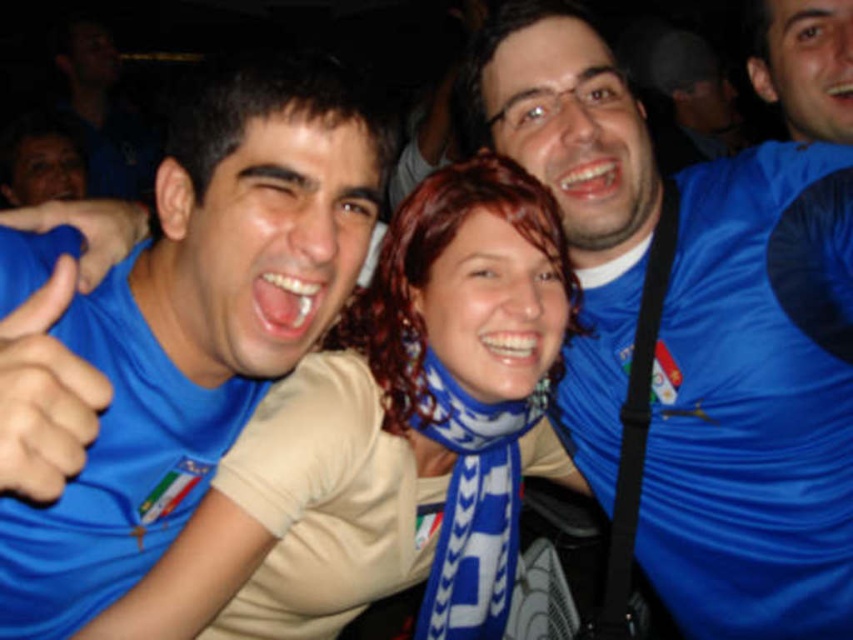
Question: Which of the following is the closest to the observer?

Choices:
 (A) blue jersey at center
 (B) white textured scarf at center

Answer: (B)

Question: Is blue jersey at left further to the viewer compared to blue fabric thumb at left?

Choices:
 (A) no
 (B) yes

Answer: (B)

Question: Does blue jersey at center have a lesser width compared to blue jersey at left?

Choices:
 (A) no
 (B) yes

Answer: (A)

Question: Which point is closer to the camera?

Choices:
 (A) (189, 548)
 (B) (109, 248)
 (C) (796, 260)

Answer: (B)

Question: Estimate the real-world distances between objects in this image. Which object is farther from the blue jersey at center?

Choices:
 (A) blue fabric thumb at left
 (B) blue jersey at left
 (C) blue fabric hand at center

Answer: (A)

Question: Can you confirm if blue jersey at center is wider than blue fabric thumb at left?

Choices:
 (A) yes
 (B) no

Answer: (A)